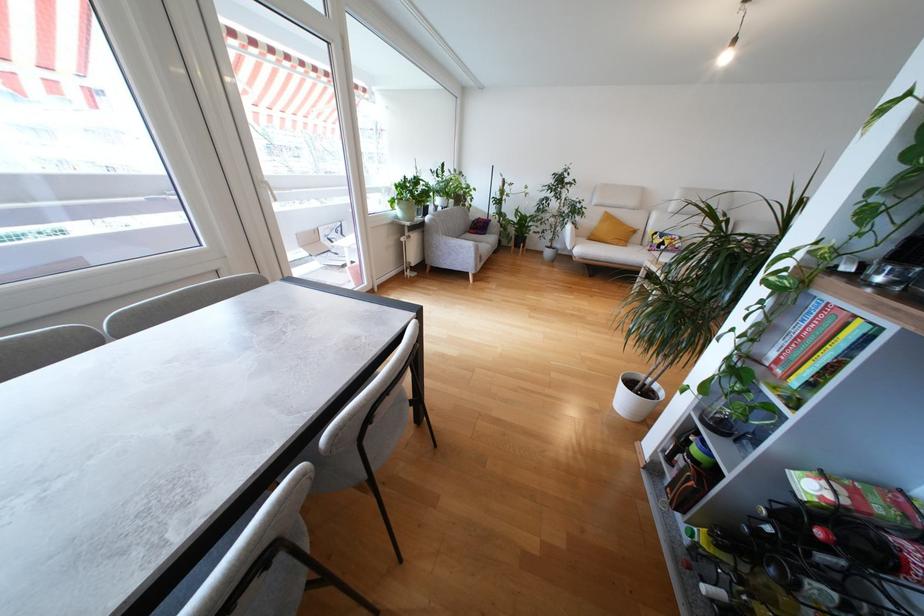
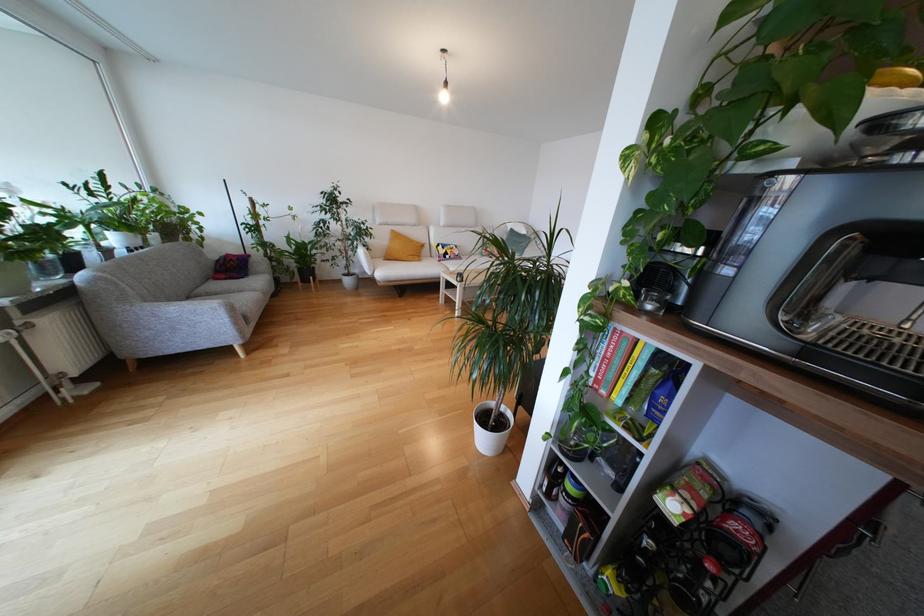
The point at [661,252] is marked in the first image. Where is the corresponding point in the second image?

(448, 262)